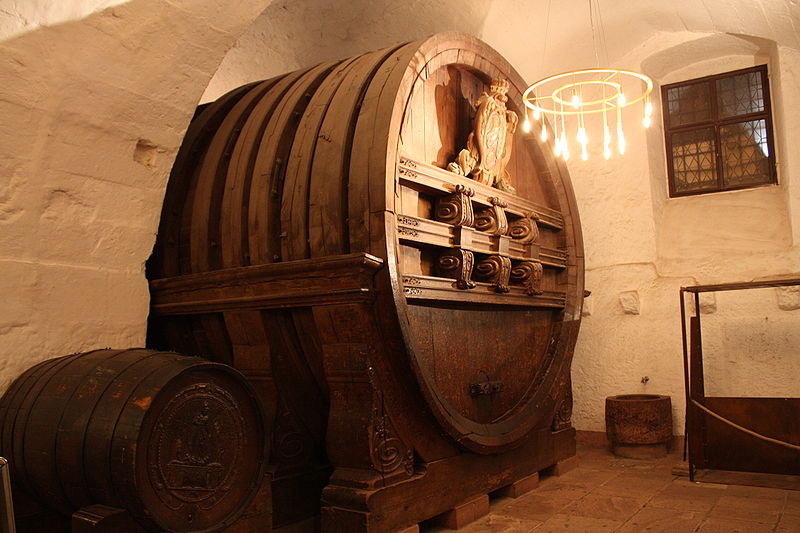
Find the location of a particular element. This screenshot has width=800, height=533. lighting is located at coordinates (589, 102).